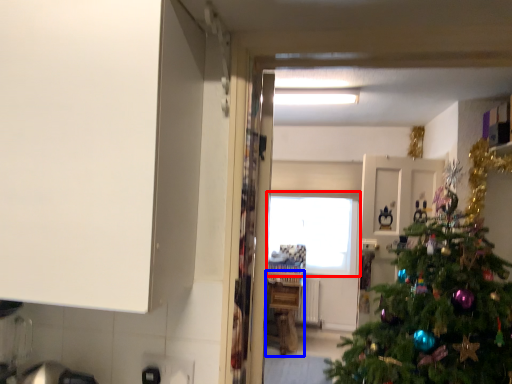
Question: Which object appears closest to the camera in this image, window (highlighted by a red box) or counter (highlighted by a blue box)?

Choices:
 (A) window
 (B) counter

Answer: (B)